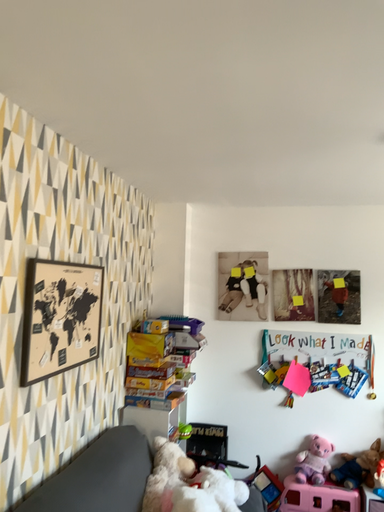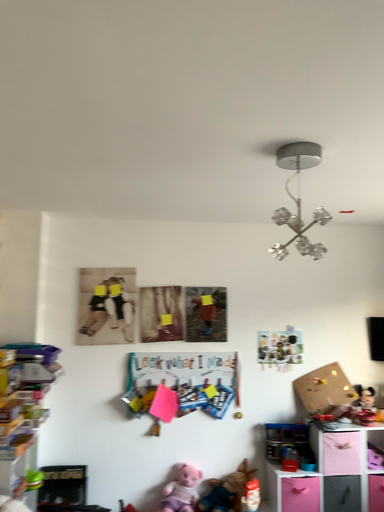
Question: Which way did the camera rotate in the video?

Choices:
 (A) rotated right
 (B) rotated left

Answer: (A)